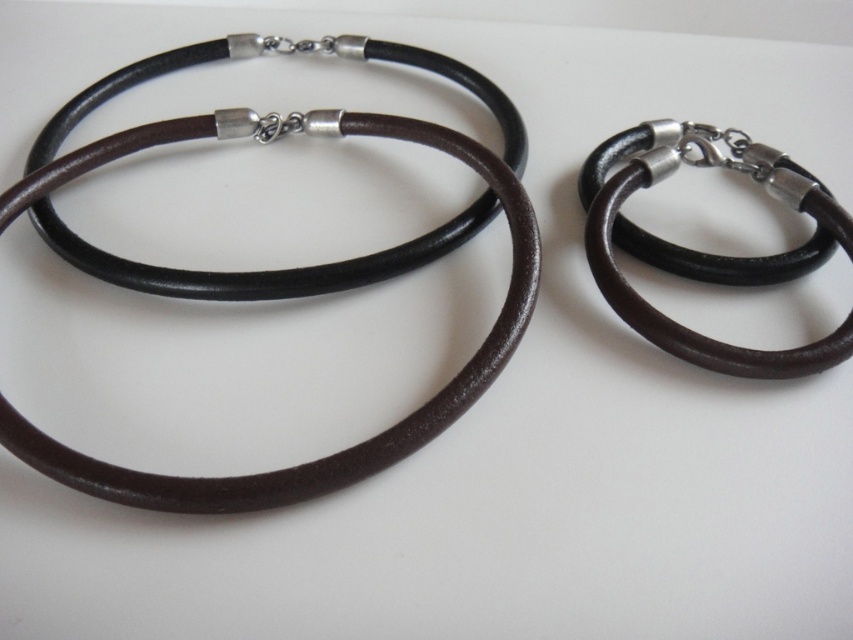
Is point (518, 160) closer to viewer compared to point (596, 269)?

No.

Consider the image. Who is more forward, (x=149, y=502) or (x=639, y=161)?

Point (x=149, y=502) is more forward.

Does point (300, 477) come closer to viewer compared to point (763, 266)?

Yes, it is in front of point (763, 266).

Identify the location of brown leather necklace at left. (279, 276).